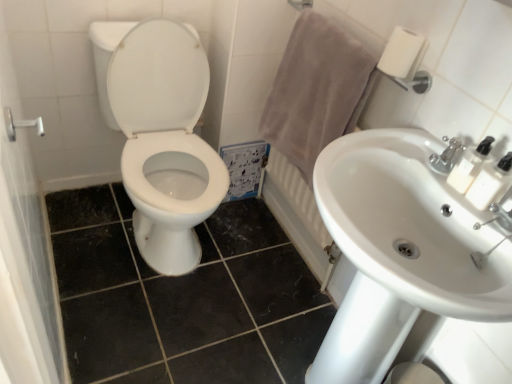
Identify the location of vacant area on the back side of satin nickel faucet at upper right. (423, 138).